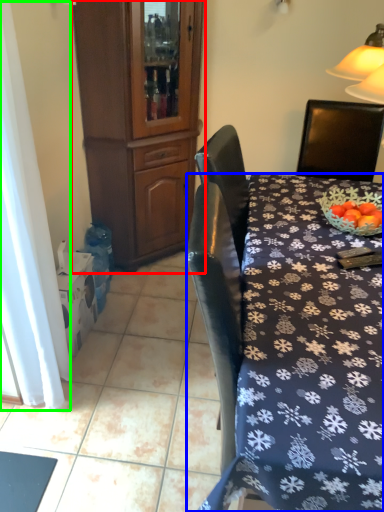
Question: Estimate the real-world distances between objects in this image. Which object is closer to cabinetry (highlighted by a red box), desk (highlighted by a blue box) or curtain (highlighted by a green box)?

Choices:
 (A) desk
 (B) curtain

Answer: (B)